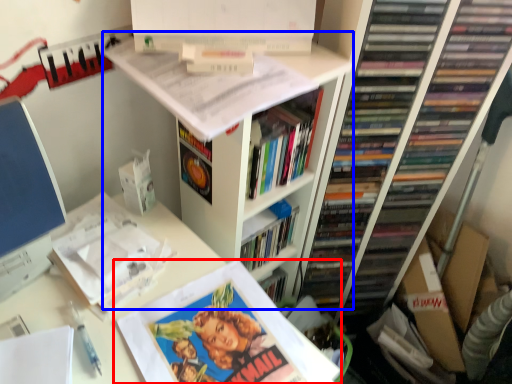
Question: Which object is further to the camera taking this photo, book (highlighted by a red box) or bookshelf (highlighted by a blue box)?

Choices:
 (A) book
 (B) bookshelf

Answer: (B)